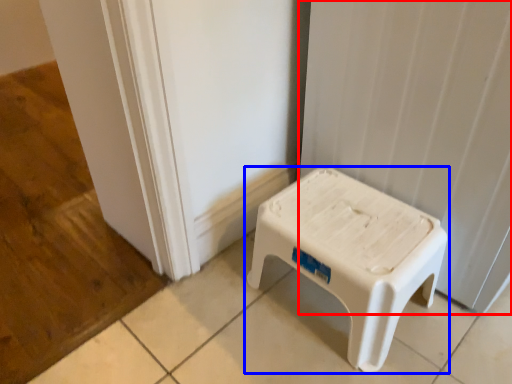
Question: Which object is further to the camera taking this photo, curtain (highlighted by a red box) or stool (highlighted by a blue box)?

Choices:
 (A) curtain
 (B) stool

Answer: (B)